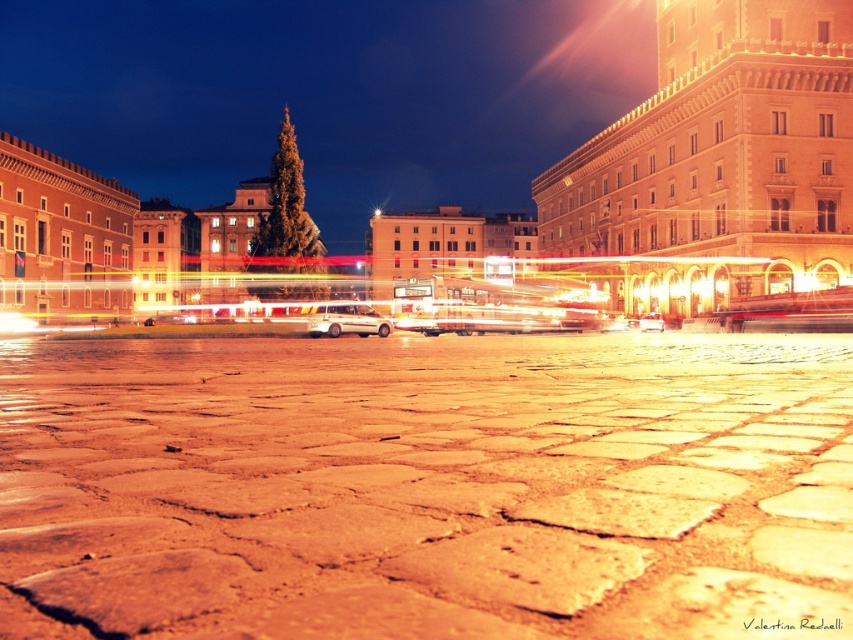
Between smooth stone square at center and metallic silver car at center, which one is positioned higher?

metallic silver car at center is above.

Measure the distance between point (666, 515) and camera.

Point (666, 515) is 22.97 meters from camera.

Find the location of a particular element. This screenshot has height=640, width=853. smooth stone square at center is located at coordinates click(618, 513).

Is smooth stone pavement at center wider than white matte van at center?

Yes.

Who is more forward, (282,529) or (331,312)?

Positioned in front is point (282,529).

Locate an element on the screen. The width and height of the screenshot is (853, 640). smooth stone pavement at center is located at coordinates (421, 486).

The width and height of the screenshot is (853, 640). Describe the element at coordinates (421, 486) in the screenshot. I see `smooth stone pavement at center` at that location.

What do you see at coordinates (421, 486) in the screenshot? I see `smooth stone pavement at center` at bounding box center [421, 486].

I want to click on smooth stone pavement at center, so click(421, 486).